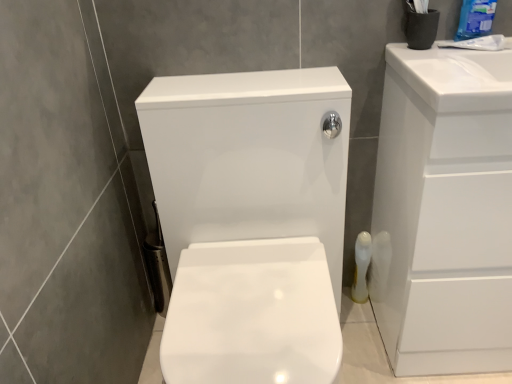
Describe the element at coordinates (446, 209) in the screenshot. Image resolution: width=512 pixels, height=384 pixels. I see `white glossy sink at right` at that location.

Locate an element on the screen. The width and height of the screenshot is (512, 384). white glossy sink at right is located at coordinates (446, 209).

Where is `white glossy sink at right`? This screenshot has width=512, height=384. white glossy sink at right is located at coordinates (446, 209).